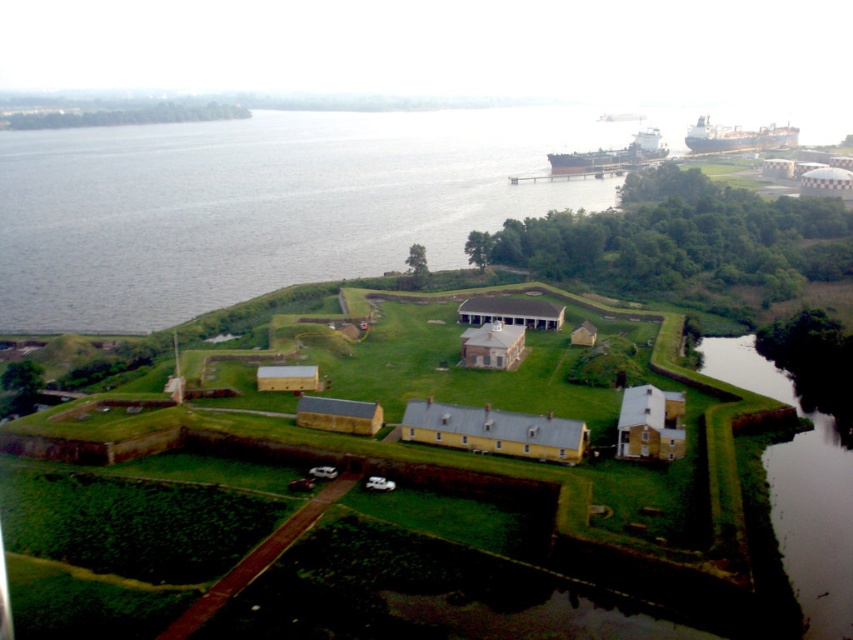
Question: Among these objects, which one is farthest from the camera?

Choices:
 (A) gray water at upper left
 (B) black matte cargo ship at upper right
 (C) metallic gray ship at upper right

Answer: (B)

Question: Which of the following is the closest to the observer?

Choices:
 (A) (692, 148)
 (B) (396, 164)
 (C) (782, 508)
 (D) (625, 170)

Answer: (C)

Question: Does gray water at upper left have a larger size compared to black matte cargo ship at upper right?

Choices:
 (A) no
 (B) yes

Answer: (B)

Question: Is metallic gray ship at upper right above black matte cargo ship at upper right?

Choices:
 (A) yes
 (B) no

Answer: (B)

Question: Based on their relative distances, which object is nearer to the gray water at upper left?

Choices:
 (A) metallic gray ship at upper right
 (B) green grassy embankment at lower right
 (C) black matte cargo ship at upper right

Answer: (A)

Question: Observing the image, what is the correct spatial positioning of gray water at upper left in reference to metallic gray ship at upper right?

Choices:
 (A) above
 (B) below

Answer: (B)